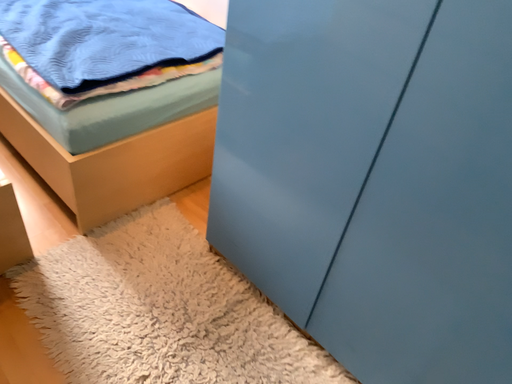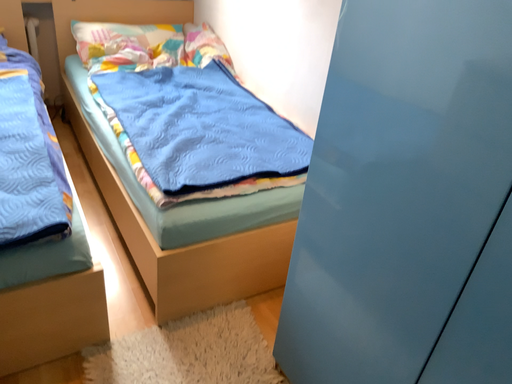
Question: How did the camera likely rotate when shooting the video?

Choices:
 (A) rotated left
 (B) rotated right

Answer: (A)